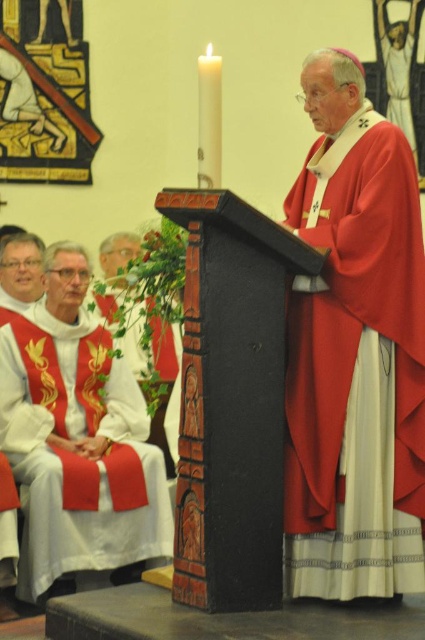
You are an attendee at the ceremony and need to determine the spatial relationship between the two red items. Which of the two, the matte red fabric at center or the matte red vestment at left, is closer to you?

The matte red fabric at center is closer to you because it is in front of the matte red vestment at left.

You are an assistant at the ceremony and need to adjust the position of the matte red fabric at center and the matte red vestment at left. Which object should you move to the left to align them properly?

The matte red fabric at center is currently to the right of the matte red vestment at left. To align them properly, you should move the matte red fabric at center to the left until it is positioned next to or in line with the matte red vestment at left.